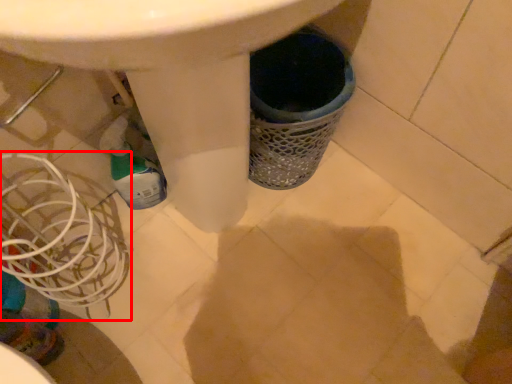
Question: Observing the image, what is the correct spatial positioning of basket (annotated by the red box) in reference to bottle?

Choices:
 (A) right
 (B) left

Answer: (B)